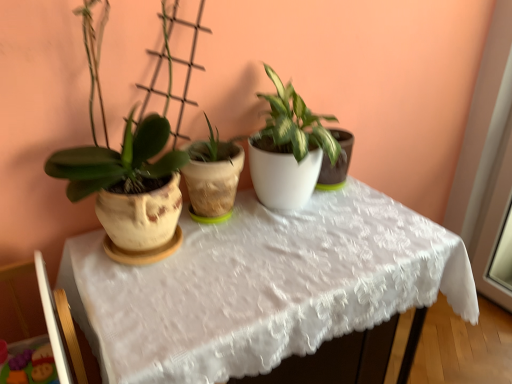
Question: Is matte clay pot at left spatially inside white lace tablecloth at center, or outside of it?

Choices:
 (A) outside
 (B) inside

Answer: (A)

Question: Considering the positions of point pos(176,208) and point pos(196,246), is point pos(176,208) closer or farther from the camera than point pos(196,246)?

Choices:
 (A) closer
 (B) farther

Answer: (A)

Question: From a real-world perspective, relative to white lace tablecloth at center, is matte clay pot at left vertically above or below?

Choices:
 (A) below
 (B) above

Answer: (B)

Question: Is white lace tablecloth at center situated inside matte clay pot at left or outside?

Choices:
 (A) outside
 (B) inside

Answer: (A)

Question: Visually, is white lace tablecloth at center positioned to the left or to the right of matte clay pot at left?

Choices:
 (A) right
 (B) left

Answer: (A)

Question: Considering the positions of white lace tablecloth at center and matte clay pot at left in the image, is white lace tablecloth at center taller or shorter than matte clay pot at left?

Choices:
 (A) short
 (B) tall

Answer: (B)

Question: Considering the positions of white lace tablecloth at center and matte clay pot at left in the image, is white lace tablecloth at center bigger or smaller than matte clay pot at left?

Choices:
 (A) small
 (B) big

Answer: (B)